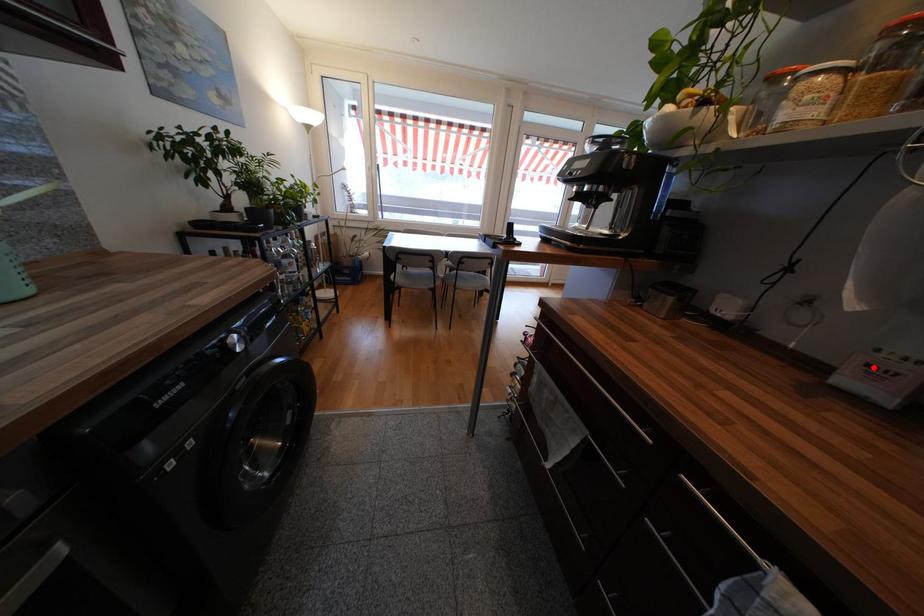
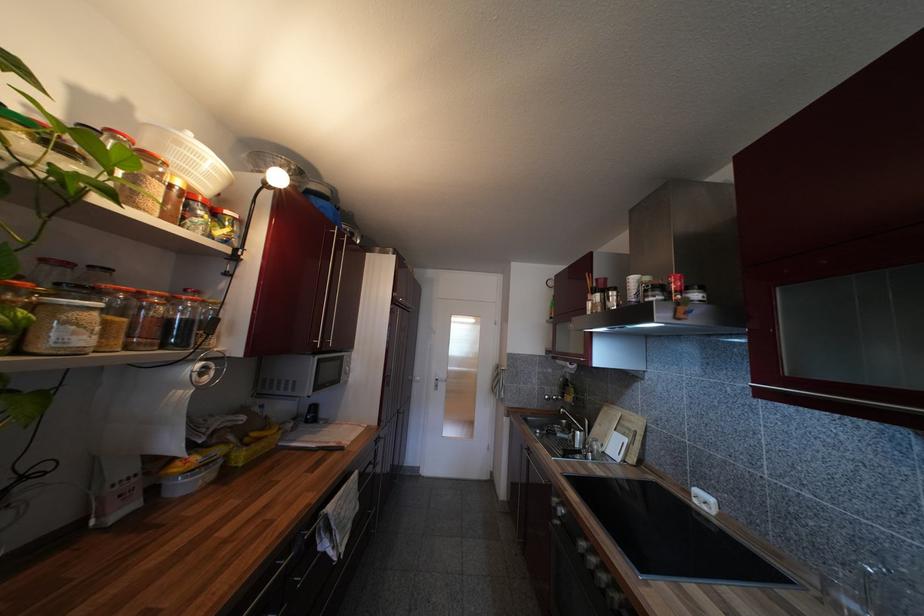
Find the pixel in the second image that matches the highlighted location in the first image.

(124, 498)